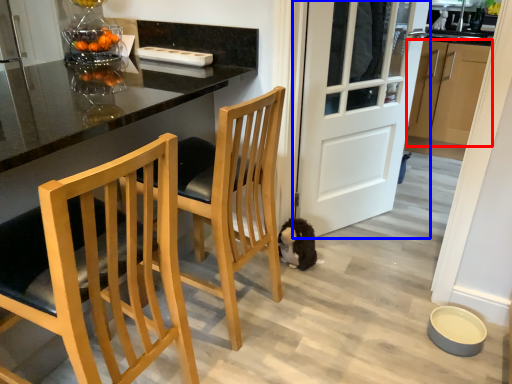
Question: Which point is closer to the camera, cabinetry (highlighted by a red box) or door (highlighted by a blue box)?

Choices:
 (A) cabinetry
 (B) door

Answer: (B)